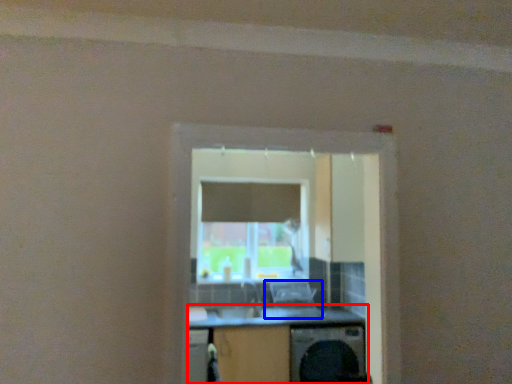
Question: Among these objects, which one is farthest to the camera, computer desk (highlighted by a red box) or computer chair (highlighted by a blue box)?

Choices:
 (A) computer desk
 (B) computer chair

Answer: (B)